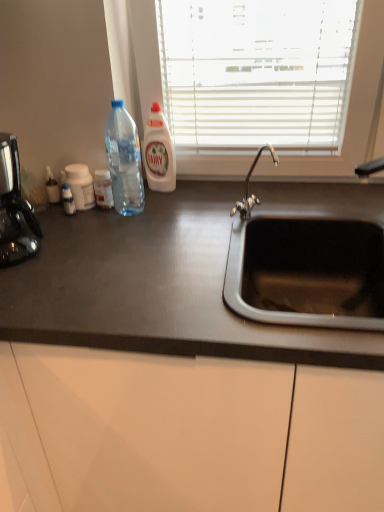
Question: From a real-world perspective, is black matte countertop at center located beneath white plastic bottle at center?

Choices:
 (A) no
 (B) yes

Answer: (B)

Question: Is black matte countertop at center behind white plastic bottle at center?

Choices:
 (A) no
 (B) yes

Answer: (A)

Question: Would you say black matte countertop at center is outside white plastic bottle at center?

Choices:
 (A) no
 (B) yes

Answer: (B)

Question: Is black matte countertop at center bigger than white plastic bottle at center?

Choices:
 (A) yes
 (B) no

Answer: (A)

Question: From the image's perspective, is black matte countertop at center beneath white plastic bottle at center?

Choices:
 (A) no
 (B) yes

Answer: (B)

Question: In the image, is black matte countertop at center positioned in front of or behind clear plastic bottle at center, which ranks as the second bottle in right-to-left order?

Choices:
 (A) behind
 (B) front

Answer: (B)

Question: Is black matte countertop at center situated inside clear plastic bottle at center, the 2th bottle positioned from the left, or outside?

Choices:
 (A) outside
 (B) inside

Answer: (A)

Question: Is black matte countertop at center bigger or smaller than clear plastic bottle at center, which ranks as the second bottle in right-to-left order?

Choices:
 (A) big
 (B) small

Answer: (A)

Question: Is point (304, 490) closer or farther from the camera than point (107, 178)?

Choices:
 (A) farther
 (B) closer

Answer: (B)

Question: Is transparent plastic bottle at left, the 1th bottle viewed from the right, inside or outside of white plastic bottle at left, positioned as the first bottle in left-to-right order?

Choices:
 (A) outside
 (B) inside

Answer: (A)

Question: Considering the positions of transparent plastic bottle at left, the 3th bottle viewed from the left, and white plastic bottle at left, the 3th bottle in the right-to-left sequence, in the image, is transparent plastic bottle at left, the 3th bottle viewed from the left, taller or shorter than white plastic bottle at left, the 3th bottle in the right-to-left sequence,?

Choices:
 (A) short
 (B) tall

Answer: (B)

Question: In the image, is transparent plastic bottle at left, the 1th bottle viewed from the right, positioned in front of or behind white plastic bottle at left, the 3th bottle in the right-to-left sequence?

Choices:
 (A) behind
 (B) front

Answer: (B)

Question: Is point (122, 214) closer or farther from the camera than point (69, 186)?

Choices:
 (A) farther
 (B) closer

Answer: (B)

Question: Which is correct: clear plastic bottle at center, the 2th bottle positioned from the left, is inside white plastic bottle at center, or outside of it?

Choices:
 (A) inside
 (B) outside

Answer: (B)

Question: Looking at the image, does clear plastic bottle at center, which ranks as the second bottle in right-to-left order, seem bigger or smaller compared to white plastic bottle at center?

Choices:
 (A) big
 (B) small

Answer: (B)